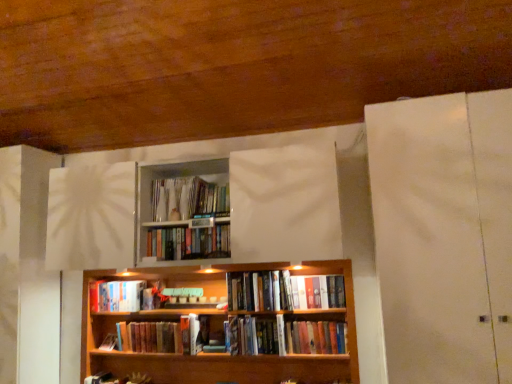
Question: Is hardcover book at center, arranged as the 5th book when viewed from the top, closer to camera compared to hardcover books at center, the 6th book positioned from the bottom?

Choices:
 (A) no
 (B) yes

Answer: (A)

Question: From the image's perspective, is hardcover book at center, arranged as the 5th book when viewed from the top, located beneath hardcover books at center, the 6th book positioned from the bottom?

Choices:
 (A) no
 (B) yes

Answer: (B)

Question: Does hardcover book at center, arranged as the 5th book when viewed from the top, have a smaller size compared to hardcover books at center, which is the second book from top to bottom?

Choices:
 (A) yes
 (B) no

Answer: (B)

Question: Is hardcover book at center, arranged as the 5th book when viewed from the top, bigger than hardcover books at center, which is the second book from top to bottom?

Choices:
 (A) yes
 (B) no

Answer: (A)

Question: Considering the relative sizes of hardcover book at center, positioned as the 3th book in bottom-to-top order, and hardcover books at center, the 6th book positioned from the bottom, in the image provided, is hardcover book at center, positioned as the 3th book in bottom-to-top order, taller than hardcover books at center, the 6th book positioned from the bottom,?

Choices:
 (A) no
 (B) yes

Answer: (B)

Question: Is point (111, 352) closer or farther from the camera than point (271, 336)?

Choices:
 (A) farther
 (B) closer

Answer: (A)

Question: From a real-world perspective, is wooden bookcase at center above or below hardcover books at center, which is the second book in bottom-to-top order?

Choices:
 (A) above
 (B) below

Answer: (A)

Question: In terms of width, does wooden bookcase at center look wider or thinner when compared to hardcover books at center, which is the second book in bottom-to-top order?

Choices:
 (A) thin
 (B) wide

Answer: (B)

Question: Is wooden bookcase at center bigger or smaller than hardcover books at center, the sixth book from the top?

Choices:
 (A) small
 (B) big

Answer: (B)

Question: Would you say hardcover book at center, positioned as the 3th book in bottom-to-top order, is to the left or to the right of hardcover books at center, which is counted as the fourth book, starting from the top, in the picture?

Choices:
 (A) left
 (B) right

Answer: (A)

Question: Considering the positions of hardcover book at center, arranged as the 5th book when viewed from the top, and hardcover books at center, which is counted as the fourth book, starting from the top, in the image, is hardcover book at center, arranged as the 5th book when viewed from the top, taller or shorter than hardcover books at center, which is counted as the fourth book, starting from the top,?

Choices:
 (A) short
 (B) tall

Answer: (A)

Question: Considering the positions of hardcover book at center, arranged as the 5th book when viewed from the top, and hardcover books at center, which is counted as the fourth book, starting from the top, in the image, is hardcover book at center, arranged as the 5th book when viewed from the top, bigger or smaller than hardcover books at center, which is counted as the fourth book, starting from the top,?

Choices:
 (A) small
 (B) big

Answer: (A)

Question: In terms of width, does hardcover book at center, positioned as the 3th book in bottom-to-top order, look wider or thinner when compared to hardcover books at center, which ranks as the fourth book in bottom-to-top order?

Choices:
 (A) wide
 (B) thin

Answer: (A)

Question: From a real-world perspective, is white matte door at right positioned above or below hardcover book at center, acting as the 5th book starting from the bottom?

Choices:
 (A) below
 (B) above

Answer: (B)

Question: Is white matte door at right situated inside hardcover book at center, the 3th book from the top, or outside?

Choices:
 (A) outside
 (B) inside

Answer: (A)